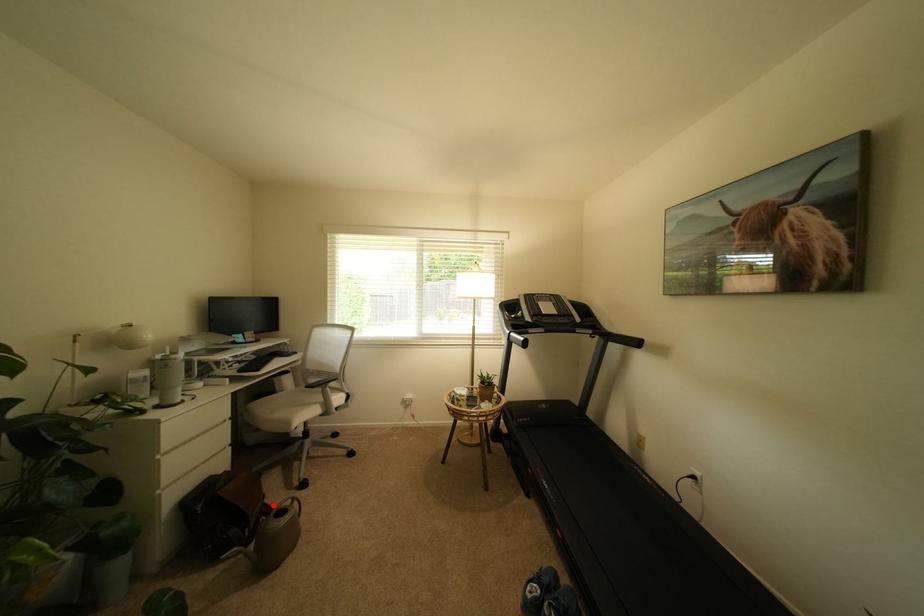
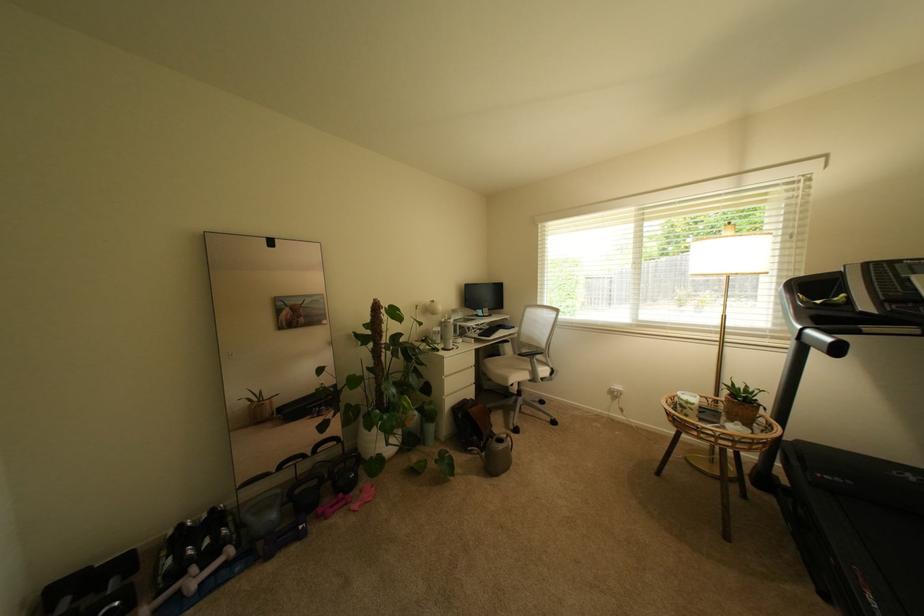
Find the pixel in the second image that matches the highlighted location in the first image.

(500, 432)